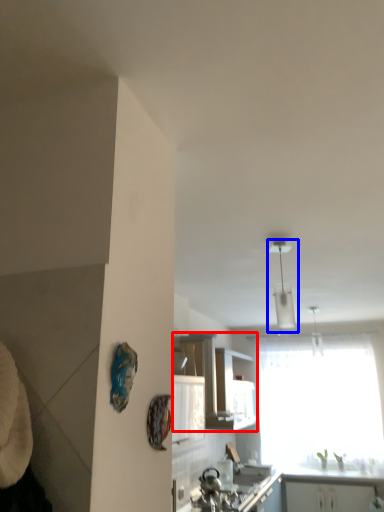
Question: Which object appears farthest to the camera in this image, cabinetry (highlighted by a red box) or light fixture (highlighted by a blue box)?

Choices:
 (A) cabinetry
 (B) light fixture

Answer: (A)